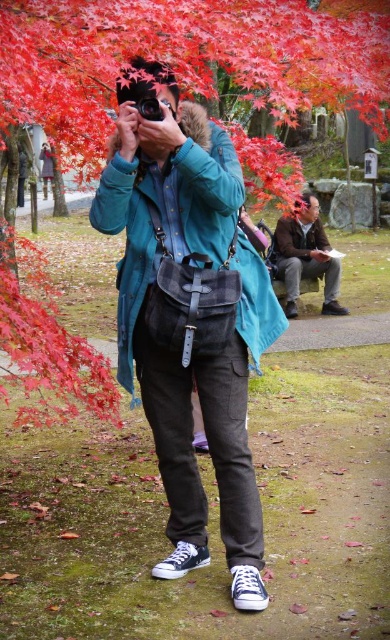
Question: Estimate the real-world distances between objects in this image. Which object is farther from the black leather camera at center?

Choices:
 (A) matte black camera at center
 (B) shiny red maple leaf at upper left

Answer: (B)

Question: Is brown leather jacket at lower right to the right of black leather camera at center from the viewer's perspective?

Choices:
 (A) yes
 (B) no

Answer: (A)

Question: Does shiny red maple leaf at upper left have a greater width compared to black leather camera at center?

Choices:
 (A) no
 (B) yes

Answer: (B)

Question: Observing the image, what is the correct spatial positioning of brown leather jacket at lower right in reference to black leather camera at center?

Choices:
 (A) left
 (B) right

Answer: (B)

Question: Based on their relative distances, which object is nearer to the shiny red maple leaf at upper left?

Choices:
 (A) matte black camera at center
 (B) black leather camera at center
 (C) brown leather jacket at lower right

Answer: (A)

Question: Among these points, which one is nearest to the camera?

Choices:
 (A) (191, 369)
 (B) (33, 385)

Answer: (B)